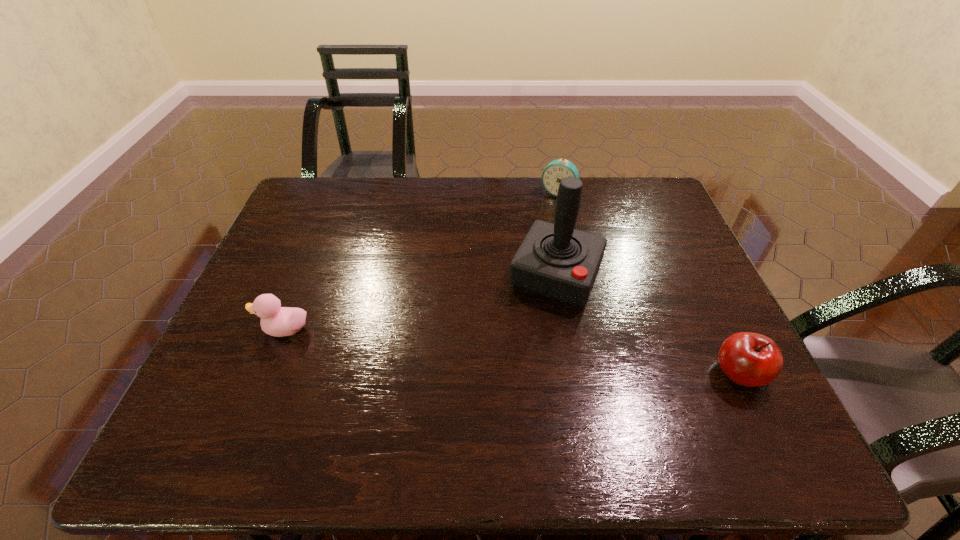
This screenshot has height=540, width=960. Find the location of `the leftmost object`. the leftmost object is located at coordinates (277, 321).

What are the coordinates of `the shortest object` in the screenshot? It's located at (277, 321).

This screenshot has height=540, width=960. Find the location of `apple`. apple is located at coordinates (750, 359).

Find the location of a particular element. The image size is (960, 540). the nearest object is located at coordinates (750, 359).

Identify the location of the farthest object. 556,170.

The image size is (960, 540). Identify the location of the tallest object. (555, 260).

Identify the location of joystick. The image size is (960, 540). (555, 260).

Image resolution: width=960 pixels, height=540 pixels. What are the coordinates of `vacant region located 0.130m on the back of the rightmost object` in the screenshot? It's located at (708, 309).

This screenshot has height=540, width=960. In order to click on vacant region located 0.220m on the front-facing side of the farthest object in this screenshot , I will do `click(529, 241)`.

Identify the location of free space located 0.200m on the front-facing side of the farthest object. The width and height of the screenshot is (960, 540). (531, 237).